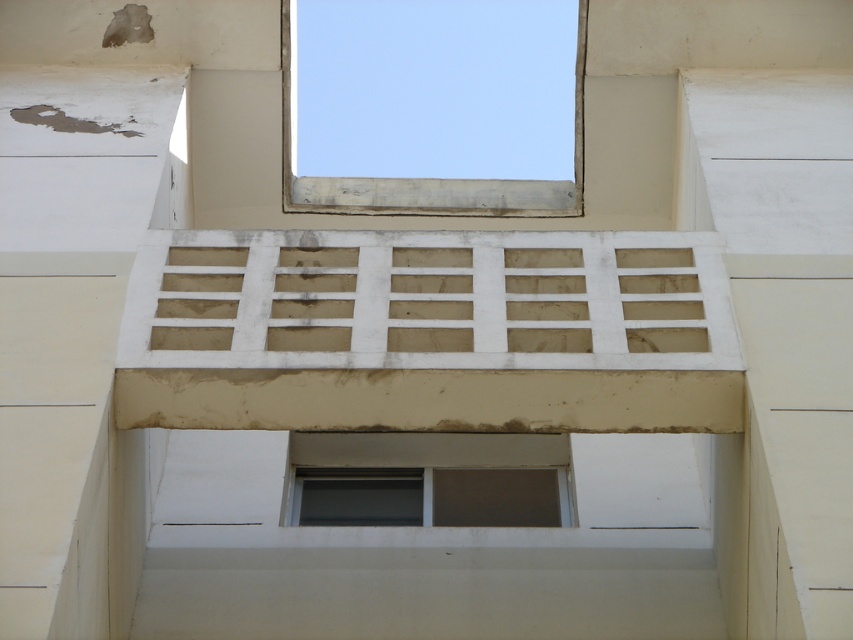
Who is positioned more to the right, clear glass window at upper center or matte gray window at center?

clear glass window at upper center

Does clear glass window at upper center have a smaller size compared to matte gray window at center?

Actually, clear glass window at upper center might be larger than matte gray window at center.

Who is more forward, (x=511, y=179) or (x=381, y=464)?

Point (x=381, y=464) is in front.

Where is `clear glass window at upper center`? This screenshot has height=640, width=853. clear glass window at upper center is located at coordinates (433, 106).